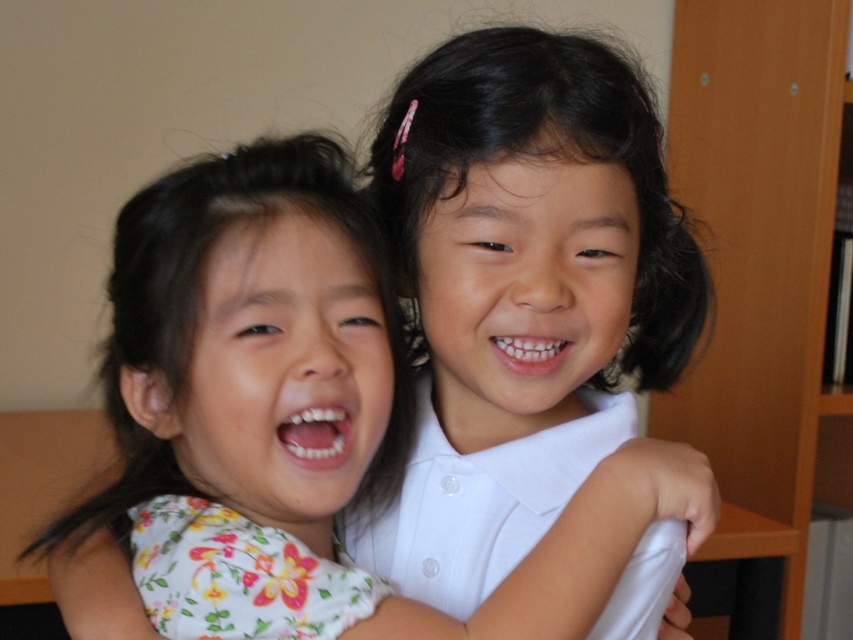
Question: Is white smooth shirt at upper right above wooden bookshelf at right?

Choices:
 (A) no
 (B) yes

Answer: (A)

Question: Which point is closer to the camera?

Choices:
 (A) (231, 301)
 (B) (788, 422)
 (C) (613, 620)

Answer: (A)

Question: Does white smooth shirt at upper right have a lesser width compared to wooden bookshelf at right?

Choices:
 (A) yes
 (B) no

Answer: (A)

Question: Which object is farther from the camera taking this photo?

Choices:
 (A) white smooth shirt at upper right
 (B) wooden bookshelf at right

Answer: (B)

Question: Does white smooth shirt at upper right have a smaller size compared to floral fabric shirt at center?

Choices:
 (A) no
 (B) yes

Answer: (A)

Question: Which object appears closest to the camera in this image?

Choices:
 (A) floral fabric shirt at center
 (B) white smooth shirt at upper right

Answer: (A)